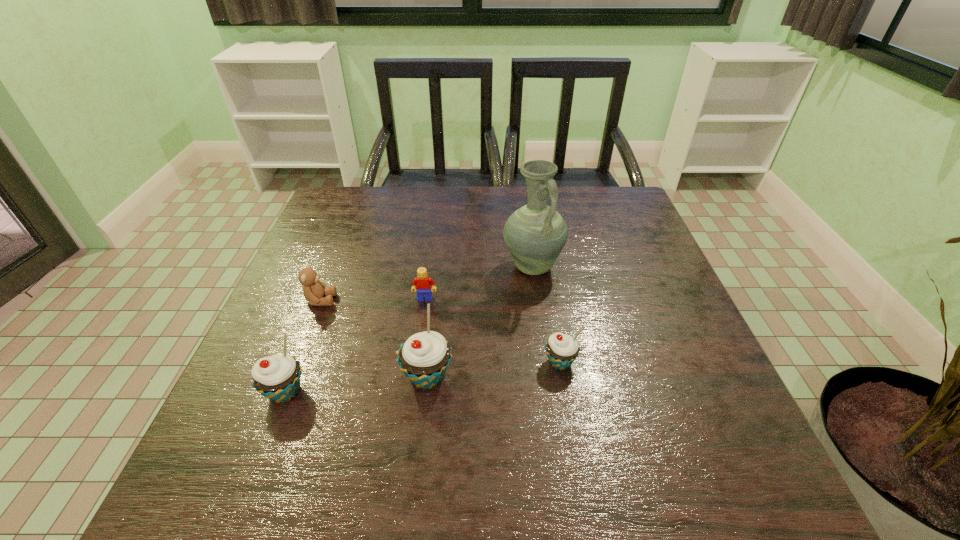
Locate an element on the screen. free space between the farthest object and the Lego is located at coordinates (478, 282).

In order to click on free space that is in between the shortest cupcake and the tallest object in this screenshot , I will do `click(546, 314)`.

Locate which object is the second closest to the second cupcake from left to right. Please provide its 2D coordinates. Your answer should be formatted as a tuple, i.e. [(x, y)], where the tuple contains the x and y coordinates of a point satisfying the conditions above.

[(277, 377)]

At what (x,y) coordinates should I click in order to perform the action: click on object that is the closest one to the fourth shortest object. Please return your answer as a coordinate pair (x, y). The image size is (960, 540). Looking at the image, I should click on (424, 358).

Identify which cupcake is the second closest to the teddy bear. Please provide its 2D coordinates. Your answer should be formatted as a tuple, i.e. [(x, y)], where the tuple contains the x and y coordinates of a point satisfying the conditions above.

[(424, 358)]

Point out which cupcake is positioned as the second nearest to the pitcher. Please provide its 2D coordinates. Your answer should be formatted as a tuple, i.e. [(x, y)], where the tuple contains the x and y coordinates of a point satisfying the conditions above.

[(424, 358)]

At what (x,y) coordinates should I click in order to perform the action: click on free point that satisfies the following two spatial constraints: 1. on the face of the second tallest cupcake; 2. on the right side of the teddy bear. Please return your answer as a coordinate pair (x, y). Image resolution: width=960 pixels, height=540 pixels. Looking at the image, I should click on pos(285,392).

The width and height of the screenshot is (960, 540). What are the coordinates of `vacant space that satisfies the following two spatial constraints: 1. on the face of the teddy bear; 2. on the back side of the second cupcake from left to right` in the screenshot? It's located at (291, 376).

Find the location of a particular element. Image resolution: width=960 pixels, height=540 pixels. free location that satisfies the following two spatial constraints: 1. on the handle side of the shortest cupcake; 2. on the right side of the tallest object is located at coordinates (545, 362).

Where is `vacant space that satisfies the following two spatial constraints: 1. on the face of the Lego; 2. on the right side of the shortest cupcake`? This screenshot has width=960, height=540. vacant space that satisfies the following two spatial constraints: 1. on the face of the Lego; 2. on the right side of the shortest cupcake is located at coordinates (417, 362).